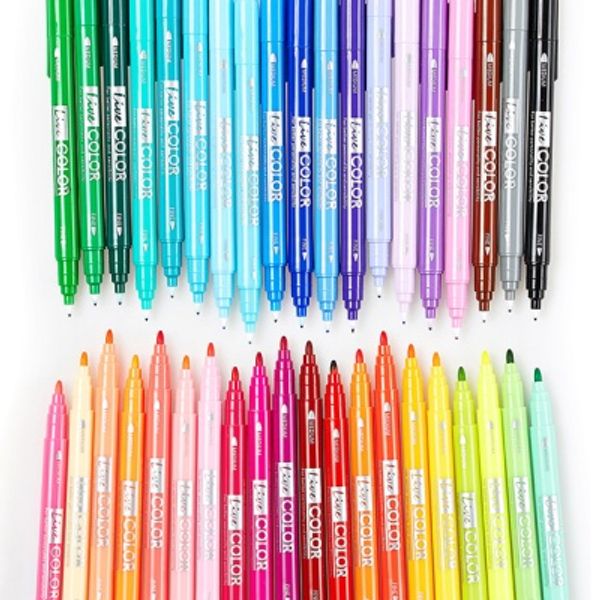
Where is `pens with blue hue`? This screenshot has height=600, width=600. pens with blue hue is located at coordinates (145, 129), (168, 129), (226, 130), (198, 135), (249, 139), (278, 139), (296, 143), (315, 147).